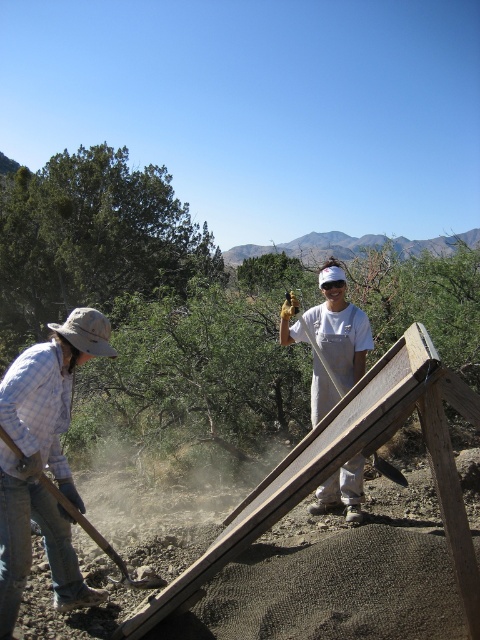
You are a construction worker observing the scene. You need to determine the spatial relationship between the plaid cotton shirt at lower left and the wooden shovel at center. Which object is closer to you?

The plaid cotton shirt at lower left is in front of the wooden shovel at center, so it is closer to you.

You are a safety inspector assessing the scene. You notice the plaid cotton shirt at lower left and the wooden handle shovel at lower left. Which object has a smaller width when viewed from above?

The plaid cotton shirt at lower left is thinner than the wooden handle shovel at lower left, so the plaid cotton shirt at lower left has a smaller width when viewed from above.